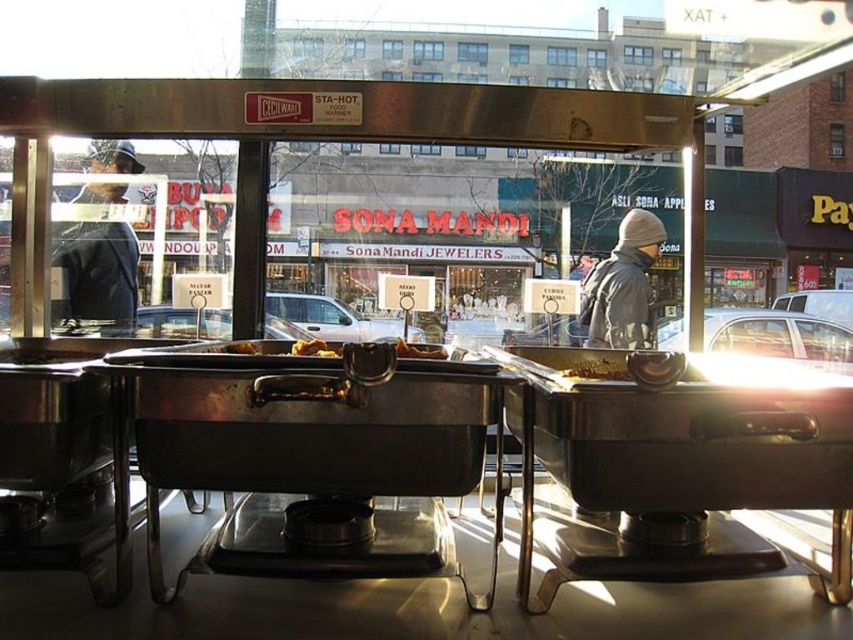
Between gray woolen hat at upper center and brown matte food at center, which one has more height?

With more height is gray woolen hat at upper center.

Image resolution: width=853 pixels, height=640 pixels. Describe the element at coordinates (624, 285) in the screenshot. I see `gray woolen hat at upper center` at that location.

Is point (631, 288) positioned in front of point (587, 358)?

No, (631, 288) is behind (587, 358).

Where is `gray woolen hat at upper center`? Image resolution: width=853 pixels, height=640 pixels. gray woolen hat at upper center is located at coordinates (624, 285).

Can you confirm if dark blue jacket at left is wider than slightly browned bread at center?

Yes.

Does dark blue jacket at left have a lesser height compared to slightly browned bread at center?

No, dark blue jacket at left is not shorter than slightly browned bread at center.

Is point (120, 193) positioned after point (404, 339)?

That is False.

In order to click on dark blue jacket at left in this screenshot , I will do `click(96, 273)`.

Who is lower down, yellow matte food at center or golden brown bread at center?

Positioned lower is yellow matte food at center.

Is yellow matte food at center further to camera compared to golden brown bread at center?

No, yellow matte food at center is in front of golden brown bread at center.

Is point (312, 339) closer to viewer compared to point (248, 340)?

No, (312, 339) is further to viewer.

Locate an element on the screen. This screenshot has height=640, width=853. yellow matte food at center is located at coordinates (312, 348).